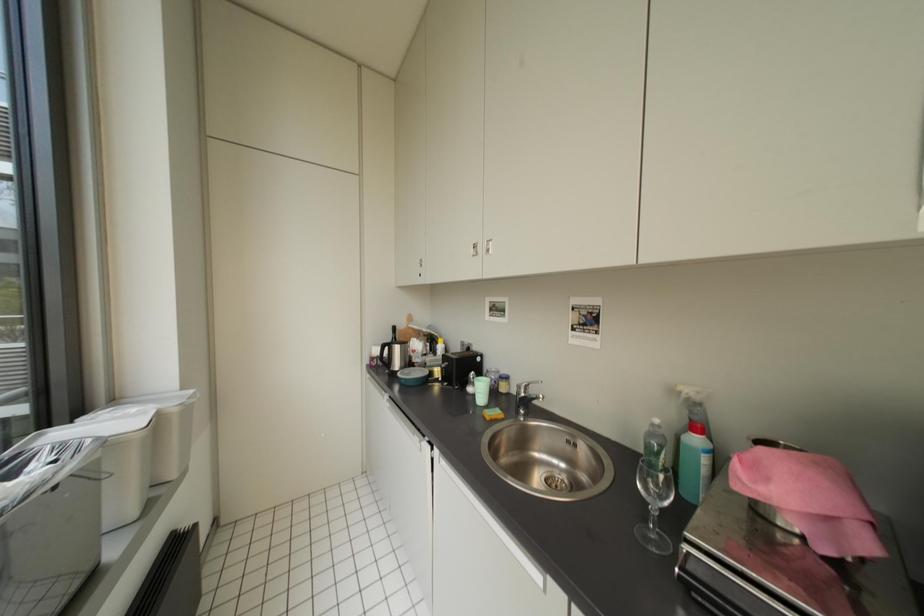
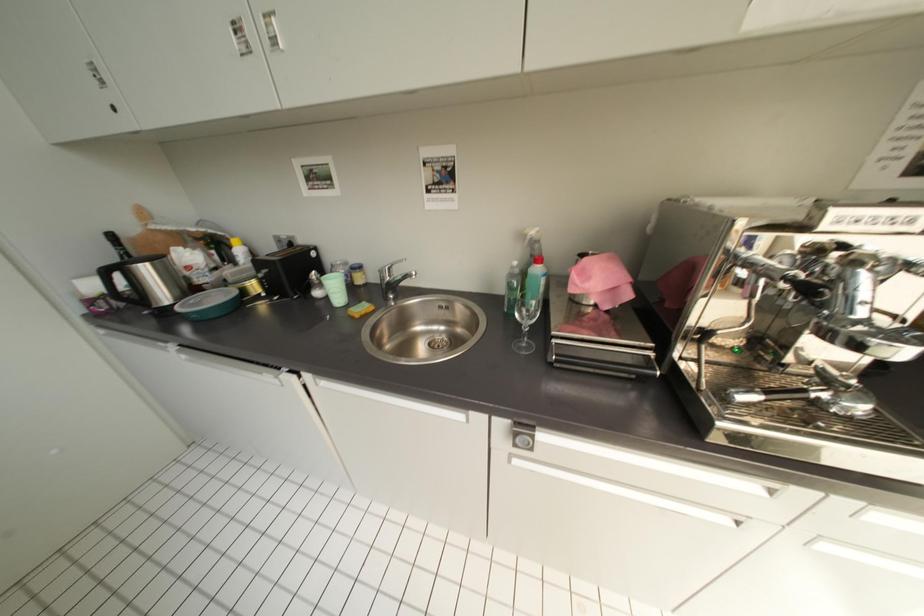
How did the camera likely rotate?

The camera rotated toward right-down.